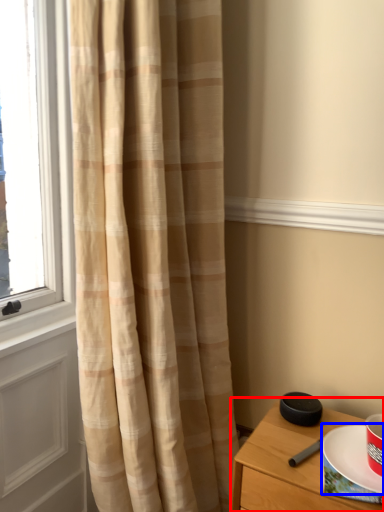
Question: Which of the following is the closest to the observer, nightstand (highlighted by a red box) or paper plate (highlighted by a blue box)?

Choices:
 (A) nightstand
 (B) paper plate

Answer: (A)